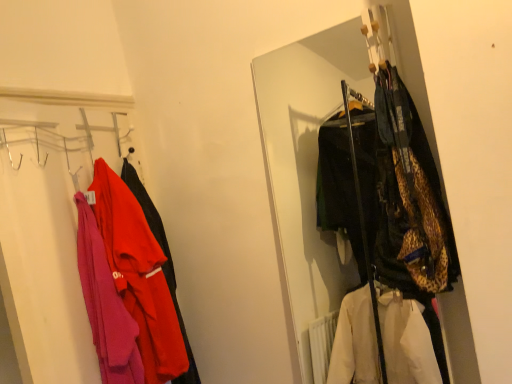
Question: From the image's perspective, is leopard print jacket at center, arranged as the 2th closet when viewed from the left, located above or below matte red jacket at left?

Choices:
 (A) below
 (B) above

Answer: (B)

Question: In the image, is leopard print jacket at center, arranged as the 2th closet when viewed from the left, positioned in front of or behind matte red jacket at left?

Choices:
 (A) behind
 (B) front

Answer: (B)

Question: Which is nearer to the leopard print jacket at center, which ranks as the first closet in right-to-left order?

Choices:
 (A) matte pink sweater at left, which is the second closet in right-to-left order
 (B) matte red jacket at left

Answer: (A)

Question: Considering the real-world distances, which object is closest to the matte red jacket at left?

Choices:
 (A) leopard print jacket at center, arranged as the 2th closet when viewed from the left
 (B) matte pink sweater at left, marked as the 1th closet in a left-to-right arrangement

Answer: (B)